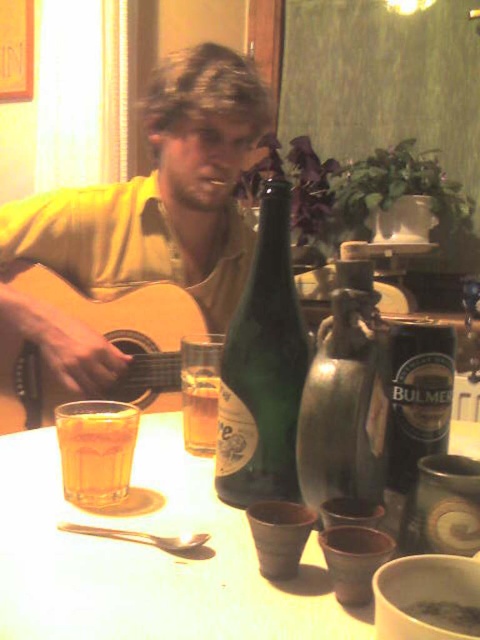
You are a bartender who needs to place a new drink order. The matte wood guitar at left and the translucent glass at table left are on the table. Which object should you prioritize moving to make space for the new drink order, considering their sizes?

The matte wood guitar at left is larger in size than the translucent glass at table left, so you should prioritize moving the smaller translucent glass at table left to make space for the new drink order.

You are a bartender who needs to place a new drink order on the table. The table has a coordinate system where the bottom left corner is the origin point. The bartender wants to place the new drink exactly 0.1 units to the right of the matte glass cup at lower left. What are the coordinates where the new drink should be placed?

The matte glass cup at lower left is at point [146,557]. Adding 0.1 to the x coordinate gives 0.973, so the new coordinates are [146,621].